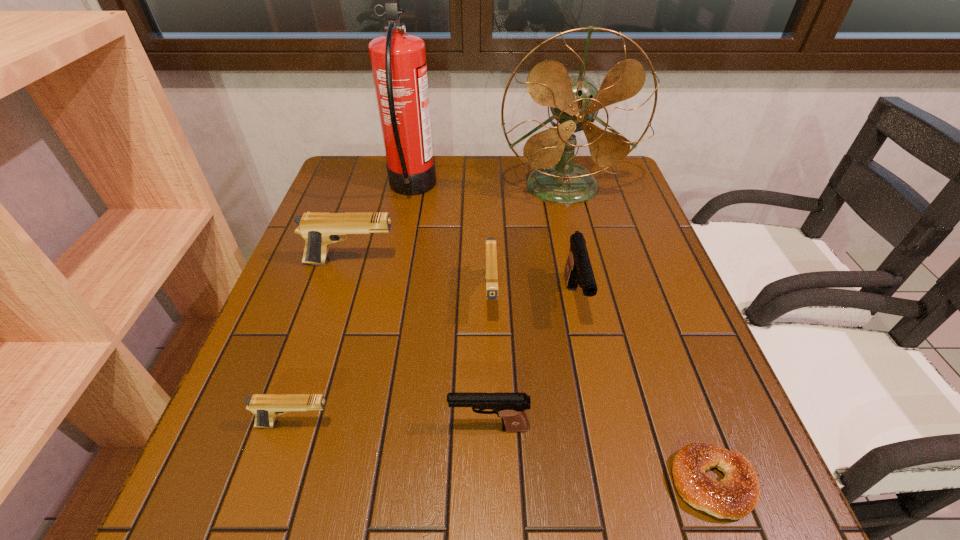
This screenshot has width=960, height=540. What are the coordinates of `free space that satisfies the following two spatial constraints: 1. at the barrel of the right black pistol; 2. at the barrel of the smaller black pistol` in the screenshot? It's located at (601, 427).

Locate an element on the screen. free space in the image that satisfies the following two spatial constraints: 1. at the barrel of the rightmost pistol; 2. at the barrel of the shortest pistol is located at coordinates (601, 424).

Find the location of `free spot that satisfies the following two spatial constraints: 1. at the barrel of the nearer black pistol; 2. on the left side of the tan bagel`. free spot that satisfies the following two spatial constraints: 1. at the barrel of the nearer black pistol; 2. on the left side of the tan bagel is located at coordinates (490, 483).